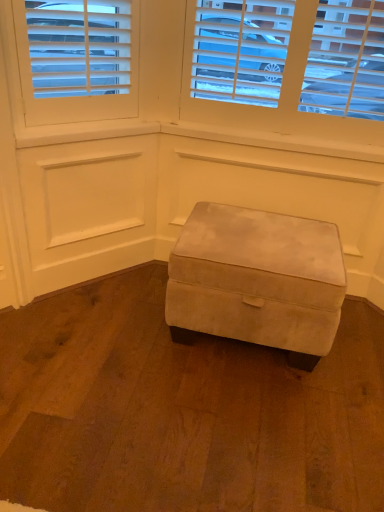
Where is `empty space that is ontop of beige suede ottoman at center`? empty space that is ontop of beige suede ottoman at center is located at coordinates (258, 234).